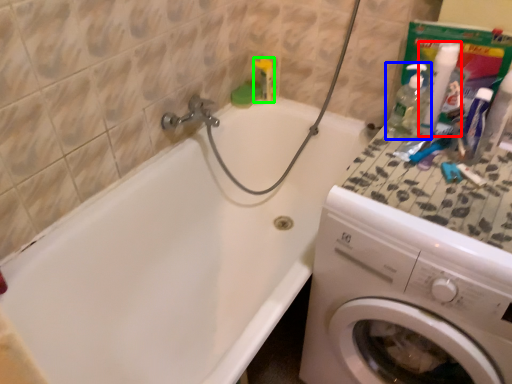
Question: Which is nearer to the cleaning product (highlighted by a red box)? cleaning product (highlighted by a blue box) or toiletry (highlighted by a green box).

Choices:
 (A) cleaning product
 (B) toiletry

Answer: (A)